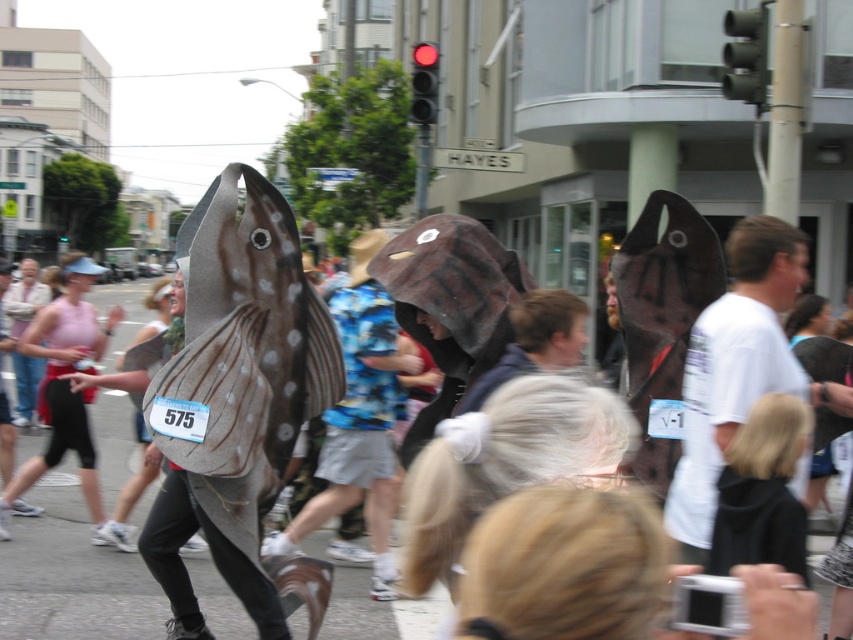
In the scene shown: You are a photographer trying to capture the white matte fish at right and the pink fabric tank top at left in the same frame. Based on their positions, which object should you focus on first to ensure both are in the frame?

The white matte fish at right is located above the pink fabric tank top at left, so you should focus on the white matte fish at right first to ensure both are in the frame.

You are a photographer trying to capture the spotted leather shark at center without the white matte fish at right blocking it. Is the shark visible in the shot?

The white matte fish at right is positioned over spotted leather shark at center, so the shark is partially or fully obscured and may not be fully visible in the shot.

You are a photographer standing at the camera position. You want to take a photo of the white matte fish at right. If your camera can focus on objects within 4 meters, will you be able to capture a clear photo?

The distance between the white matte fish at right and the camera is 3.72 meters, which is within the 4 meters focus range. Therefore, you can capture a clear photo.